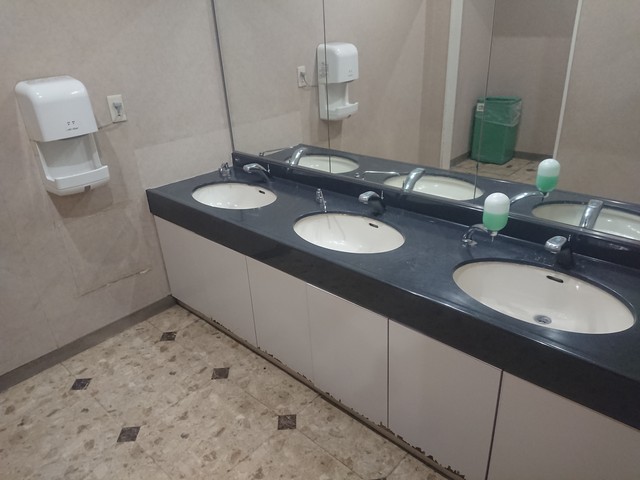
Locate an element on the screen. The height and width of the screenshot is (480, 640). wall is located at coordinates (32, 262).